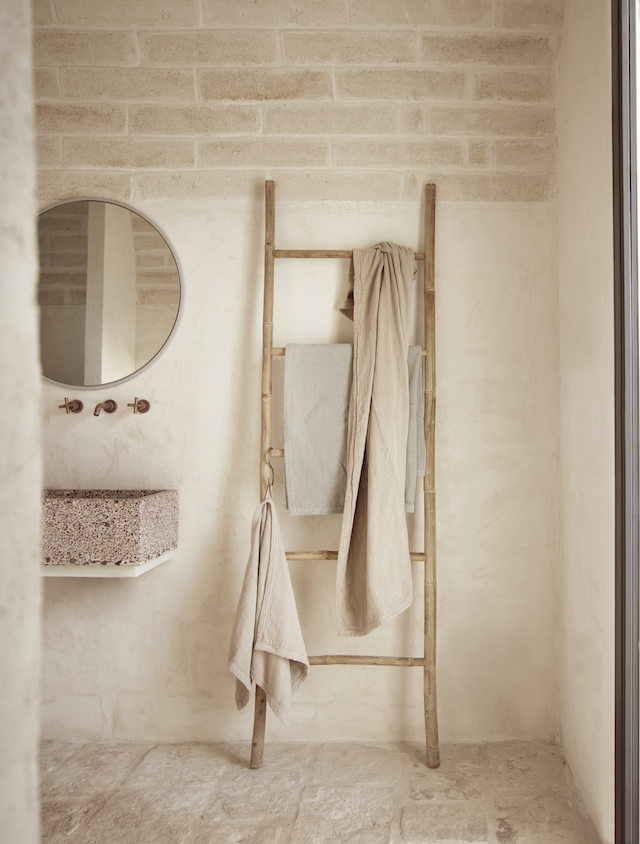
This screenshot has height=844, width=640. In order to click on left faucet in this screenshot , I will do pyautogui.click(x=68, y=404).